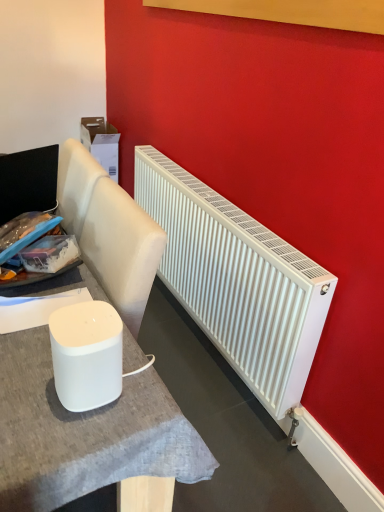
Image resolution: width=384 pixels, height=512 pixels. I want to click on vacant region to the left of white matte speaker at lower left, so click(x=25, y=371).